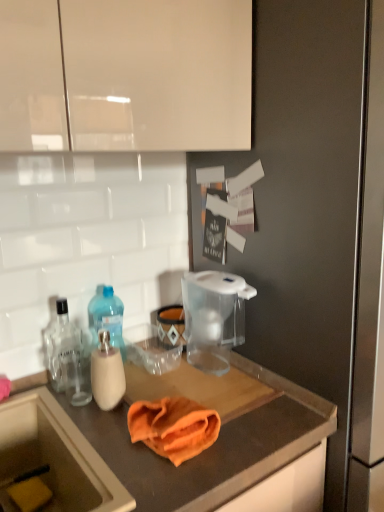
This screenshot has width=384, height=512. I want to click on vacant space that is in between orange microfiber cloth at center and transparent plastic water filter pitcher at center, so click(196, 394).